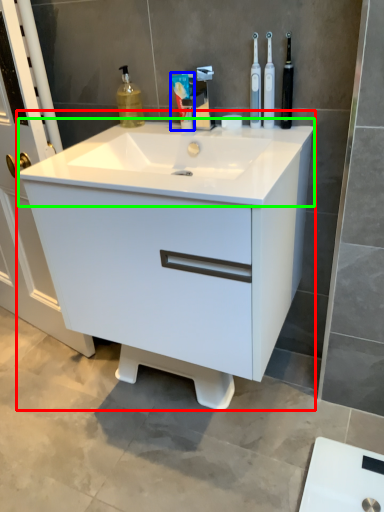
Question: Which is nearer to the bathroom cabinet (highlighted by a red box)? toothpaste (highlighted by a blue box) or counter top (highlighted by a green box).

Choices:
 (A) toothpaste
 (B) counter top

Answer: (B)